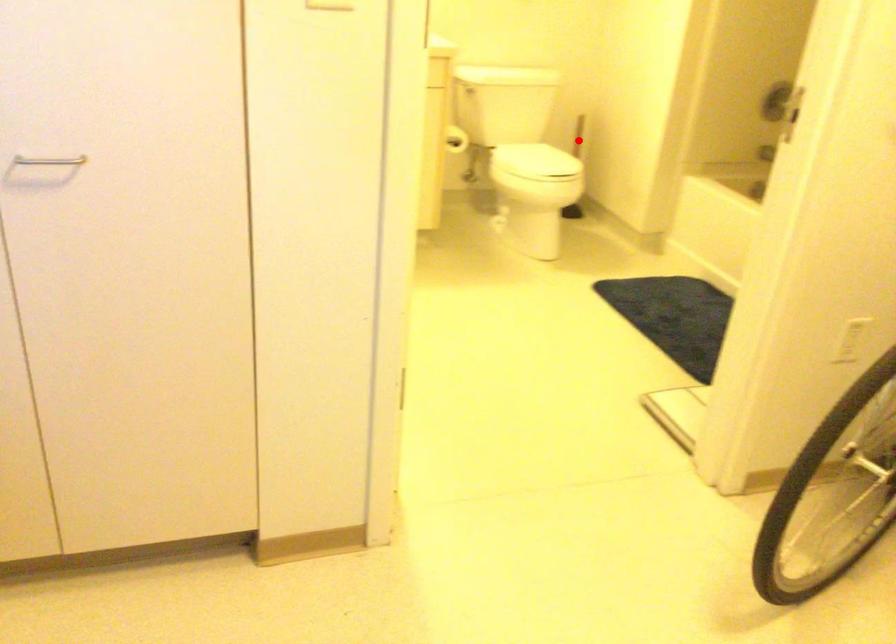
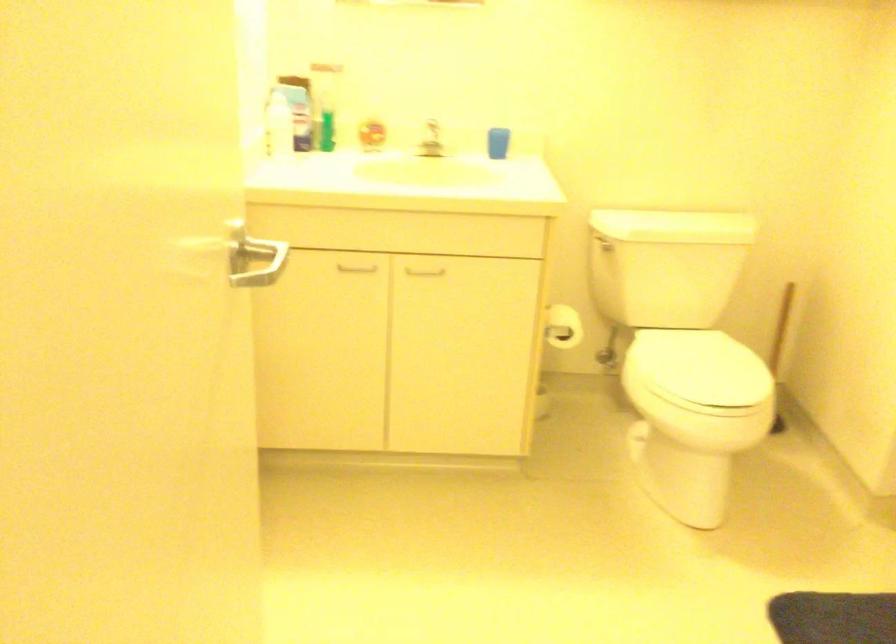
Where in the second image is the point corresponding to the highlighted location from the first image?

(780, 328)